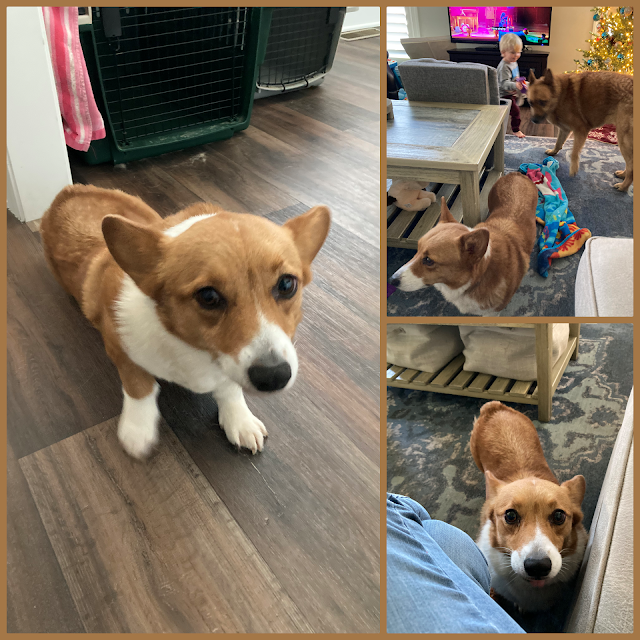
You are a GUI agent. You are given a task and a screenshot of the screen. Output one action in this format:
    pyautogui.click(x=<x>, y=<y>)
    Task: Click on the rug
    The width and height of the screenshot is (640, 640).
    Given the screenshot: What is the action you would take?
    pyautogui.click(x=582, y=410), pyautogui.click(x=591, y=173)